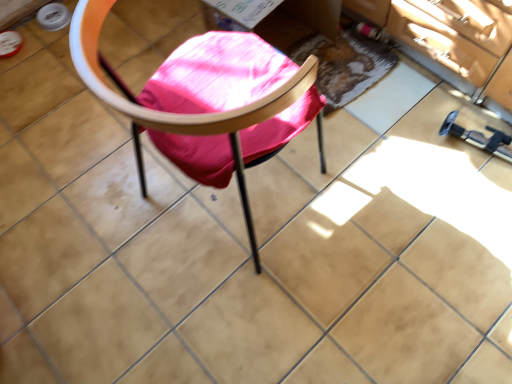
At what (x,y) coordinates should I click in order to perform the action: click on spots to the right of wooden chair at center. Please return your answer as a coordinate pair (x, y). This screenshot has width=512, height=384. Looking at the image, I should click on (372, 193).